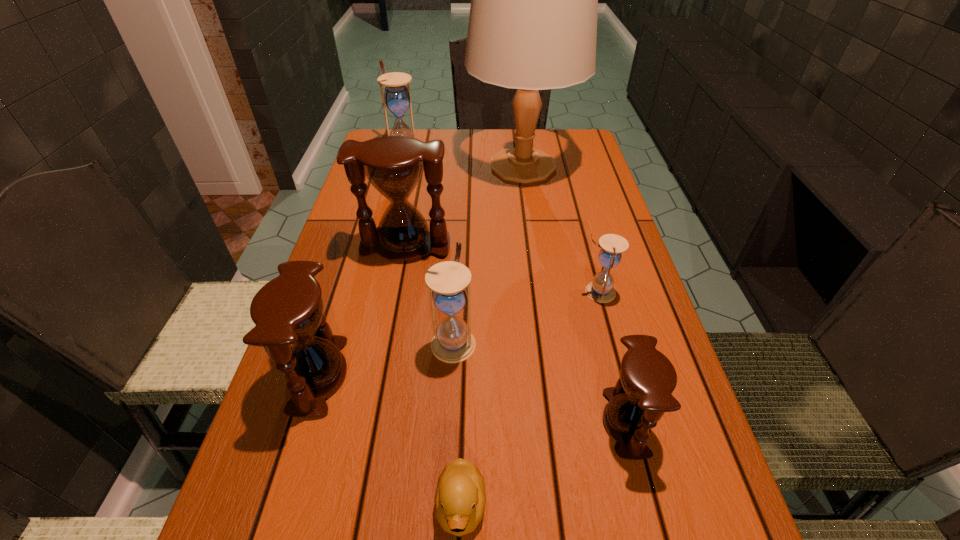
Choose which brown hourglass is the nearest neighbor to the beige table lamp. Please provide its 2D coordinates. Your answer should be formatted as a tuple, i.e. [(x, y)], where the tuple contains the x and y coordinates of a point satisfying the conditions above.

[(393, 165)]

Image resolution: width=960 pixels, height=540 pixels. Find the location of `the closest brown hourglass to the leftmost white hourglass`. the closest brown hourglass to the leftmost white hourglass is located at coordinates (393, 165).

The width and height of the screenshot is (960, 540). What are the coordinates of `free space that satisfies the following two spatial constraints: 1. on the front side of the farthest white hourglass; 2. on the right side of the beige table lamp` in the screenshot? It's located at (400, 166).

Where is `free spot that satisfies the following two spatial constraints: 1. on the front side of the biggest white hourglass; 2. on the right side of the second nearest white hourglass`? This screenshot has width=960, height=540. free spot that satisfies the following two spatial constraints: 1. on the front side of the biggest white hourglass; 2. on the right side of the second nearest white hourglass is located at coordinates (369, 292).